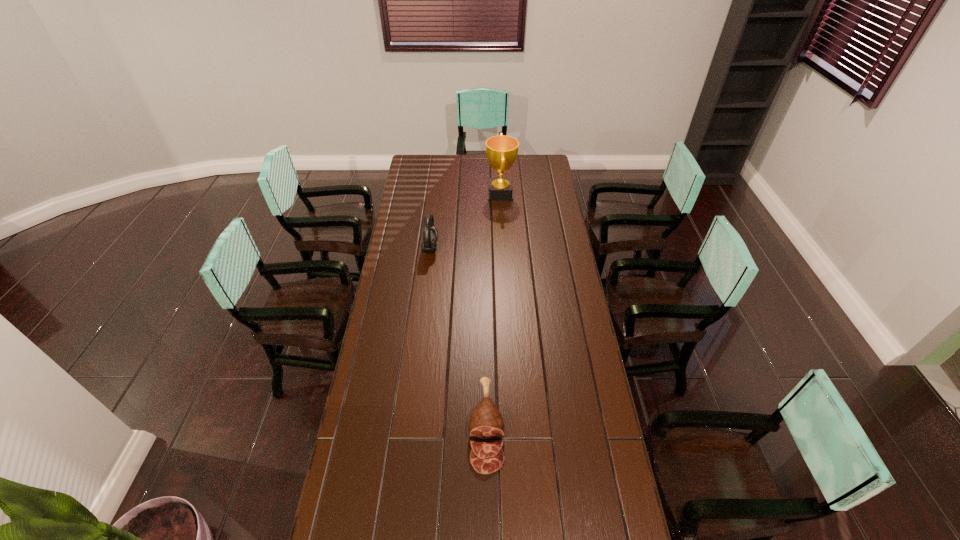
The width and height of the screenshot is (960, 540). I want to click on free region located 0.180m at the sliced end of the shortest object, so click(x=488, y=538).

The height and width of the screenshot is (540, 960). In order to click on object situated at the left edge in this screenshot , I will do `click(430, 234)`.

Find the location of a particular element. This screenshot has width=960, height=540. free space at the far edge of the desktop is located at coordinates (449, 155).

Find the location of `free point at the left edge`. free point at the left edge is located at coordinates (397, 269).

I want to click on free space at the right edge of the desktop, so click(x=534, y=175).

The height and width of the screenshot is (540, 960). Find the location of `vacant space at the far right corner of the desktop`. vacant space at the far right corner of the desktop is located at coordinates (537, 159).

The image size is (960, 540). In order to click on vacant space that's between the second tallest object and the ham in this screenshot , I will do `click(458, 338)`.

Locate an element on the screen. The height and width of the screenshot is (540, 960). vacant space in between the nearest object and the second farthest object is located at coordinates (458, 338).

You are a GUI agent. You are given a task and a screenshot of the screen. Output one action in this format:
    pyautogui.click(x=<x>, y=<y>)
    Task: Click on the vacant space in between the second farthest object and the ham
    The height and width of the screenshot is (540, 960).
    Given the screenshot: What is the action you would take?
    pos(458,338)

Identify which object is the second closest to the leftmost object. Please provide its 2D coordinates. Your answer should be formatted as a tuple, i.e. [(x, y)], where the tuple contains the x and y coordinates of a point satisfying the conditions above.

[(486, 424)]